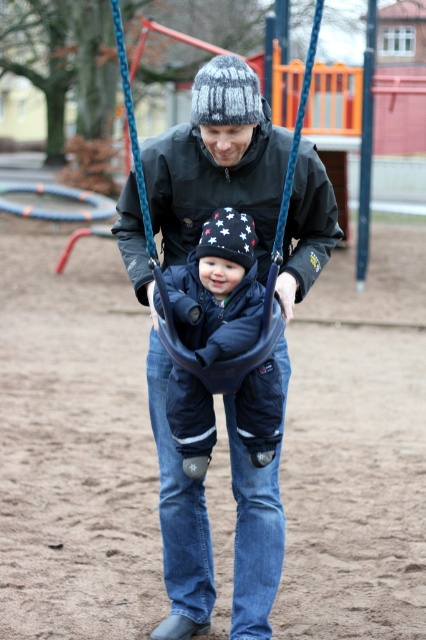
Is dark blue jeans at center further to the viewer compared to dark blue fabric baby swing at center?

Yes, dark blue jeans at center is behind dark blue fabric baby swing at center.

Image resolution: width=426 pixels, height=640 pixels. Identify the location of dark blue jeans at center. (216, 161).

The height and width of the screenshot is (640, 426). In order to click on dark blue jeans at center in this screenshot , I will do `click(216, 161)`.